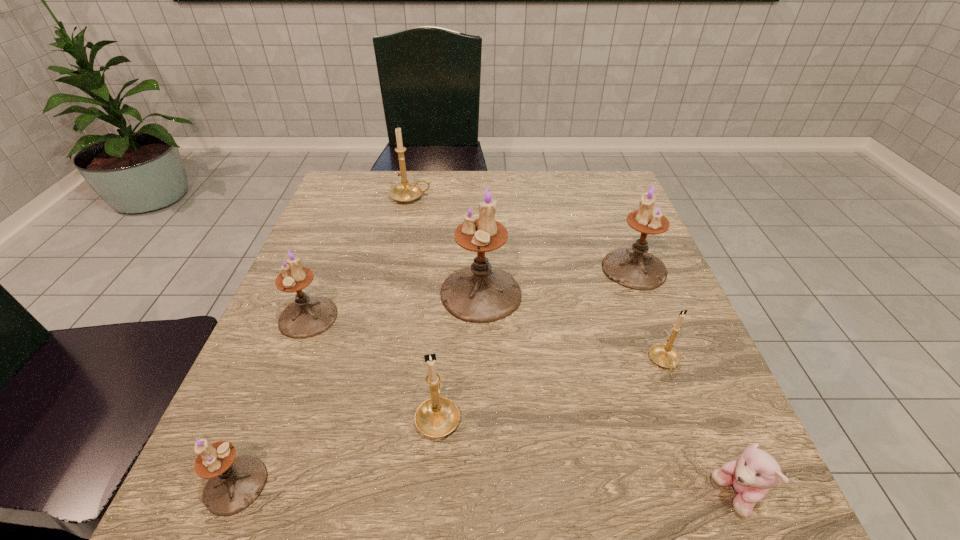
Select which candle holder is the second closest to the shortest object. Please provide its 2D coordinates. Your answer should be formatted as a tuple, i.e. [(x, y)], where the tuple contains the x and y coordinates of a point satisfying the conditions above.

[(436, 417)]

Point out which purple candle holder is positioned as the nearest to the third biggest purple candle holder. Please provide its 2D coordinates. Your answer should be formatted as a tuple, i.e. [(x, y)], where the tuple contains the x and y coordinates of a point satisfying the conditions above.

[(481, 293)]

Image resolution: width=960 pixels, height=540 pixels. Identify the location of purple candle holder that is the closest to the nearest purple candle holder. (306, 317).

Locate an element on the screen. The height and width of the screenshot is (540, 960). gold candle holder that can be found as the third closest to the nearest candle holder is located at coordinates (405, 192).

Locate which gold candle holder ranks in proximity to the smallest gold candle holder. Please provide its 2D coordinates. Your answer should be formatted as a tuple, i.e. [(x, y)], where the tuple contains the x and y coordinates of a point satisfying the conditions above.

[(436, 417)]

Locate an element on the screen. Image resolution: width=960 pixels, height=540 pixels. blank area in the image that satisfies the following two spatial constraints: 1. on the handle side of the farthest object; 2. on the front side of the smallest purple candle holder is located at coordinates (348, 485).

You are a GUI agent. You are given a task and a screenshot of the screen. Output one action in this format:
    pyautogui.click(x=<x>, y=<y>)
    Task: Click on the free space that satisfies the following two spatial constraints: 1. on the handle side of the tallest candle holder; 2. on the left side of the second smallest gold candle holder
    This screenshot has height=540, width=960.
    Given the screenshot: What is the action you would take?
    pyautogui.click(x=447, y=293)

At what (x,y) coordinates should I click in order to perform the action: click on blank space that satisfies the following two spatial constraints: 1. on the handle side of the third candle holder from left to right; 2. on the handle side of the nearest gold candle holder. Please return your answer as a coordinate pair (x, y). Image resolution: width=960 pixels, height=540 pixels. Looking at the image, I should click on (364, 415).

Image resolution: width=960 pixels, height=540 pixels. In order to click on blank space that satisfies the following two spatial constraints: 1. on the handle side of the farthest object; 2. on the handle side of the second smallest gold candle holder in this screenshot , I will do `click(364, 415)`.